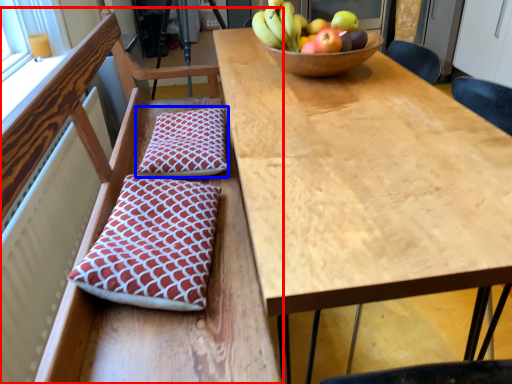
Question: Among these objects, which one is farthest to the camera, chair (highlighted by a red box) or pillow (highlighted by a blue box)?

Choices:
 (A) chair
 (B) pillow

Answer: (B)